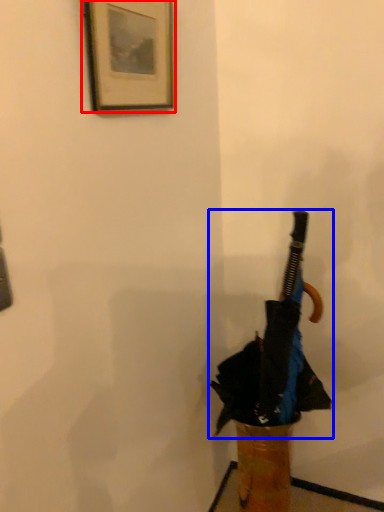
Question: Which of the following is the closest to the observer, picture frame (highlighted by a red box) or umbrella (highlighted by a blue box)?

Choices:
 (A) picture frame
 (B) umbrella

Answer: (A)